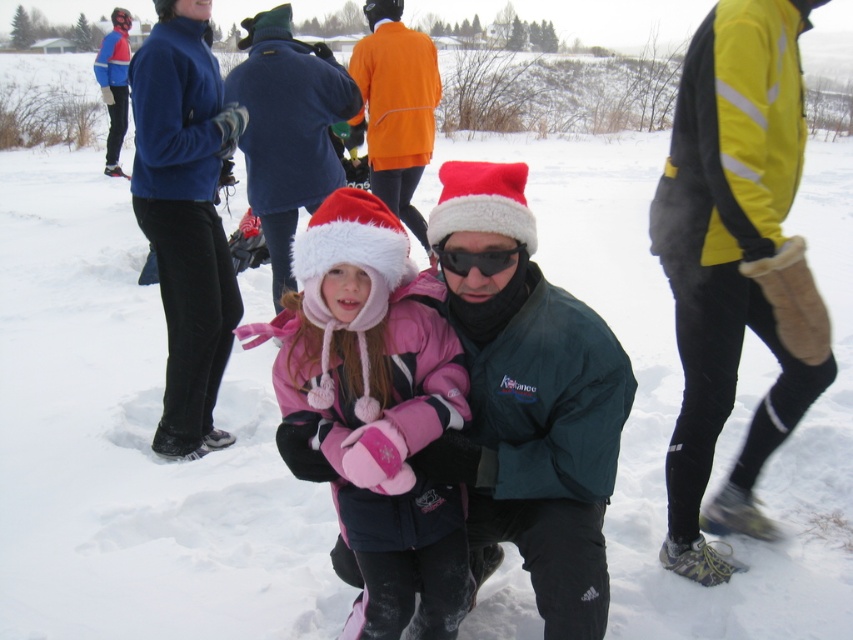
You are standing at the position of the man in the scene. You want to take a photo of the orange fleece jacket at upper center. The camera is in your hand. Can you take the photo without moving your position?

The orange fleece jacket at upper center and camera are 15.07 feet apart. Since the camera is in your hand, you can take the photo of the orange fleece jacket at upper center without moving your position because the distance between them does not affect your ability to capture the jacket in the frame.

You are a photographer trying to capture a photo of the orange fleece jacket at upper center and the black reflective goggles at center. Which object should you zoom in on to make them appear the same size in the photo?

The orange fleece jacket at upper center is bigger than the black reflective goggles at center, so you should zoom in more on the black reflective goggles at center to make them appear the same size in the photo.